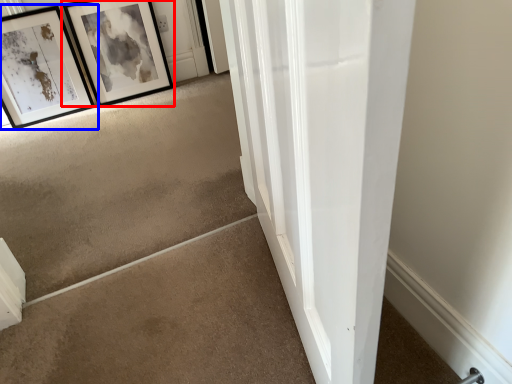
Question: Which point is further to the camera, picture frame (highlighted by a red box) or picture frame (highlighted by a blue box)?

Choices:
 (A) picture frame
 (B) picture frame

Answer: (A)